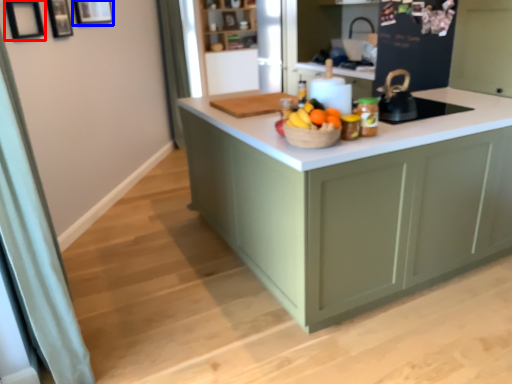
Question: Among these objects, which one is farthest to the camera, picture frame (highlighted by a red box) or picture frame (highlighted by a blue box)?

Choices:
 (A) picture frame
 (B) picture frame

Answer: (B)